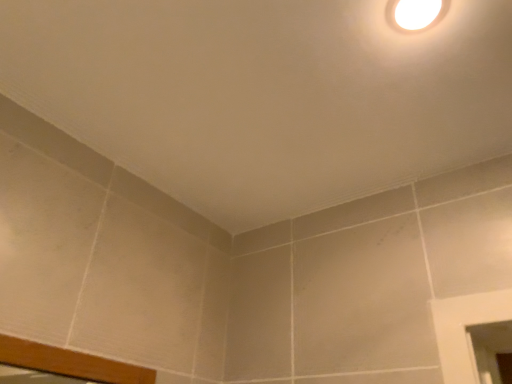
Question: Should I look upward or downward to see white matte light fixture at upper right?

Choices:
 (A) down
 (B) up

Answer: (B)